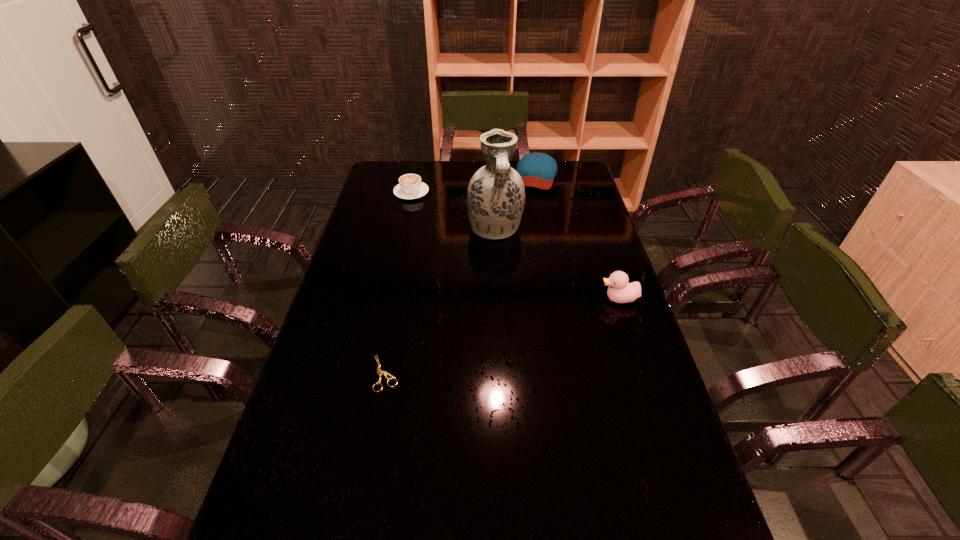
At what (x,y) coordinates should I click in order to perform the action: click on free space on the desktop that is between the shortest object and the second nearest object and is positioned with the handle on the side of the third nearest object. Please return your answer as a coordinate pair (x, y). This screenshot has width=960, height=540. Looking at the image, I should click on (527, 328).

I want to click on vacant space on the desktop that is between the shears and the rightmost object and is positioned with the bill of the third tallest object facing forward, so pyautogui.click(x=481, y=343).

I want to click on vacant space on the desktop that is between the nearest object and the duckling and is positioned on the side of the fourth tallest object with the handle, so click(540, 324).